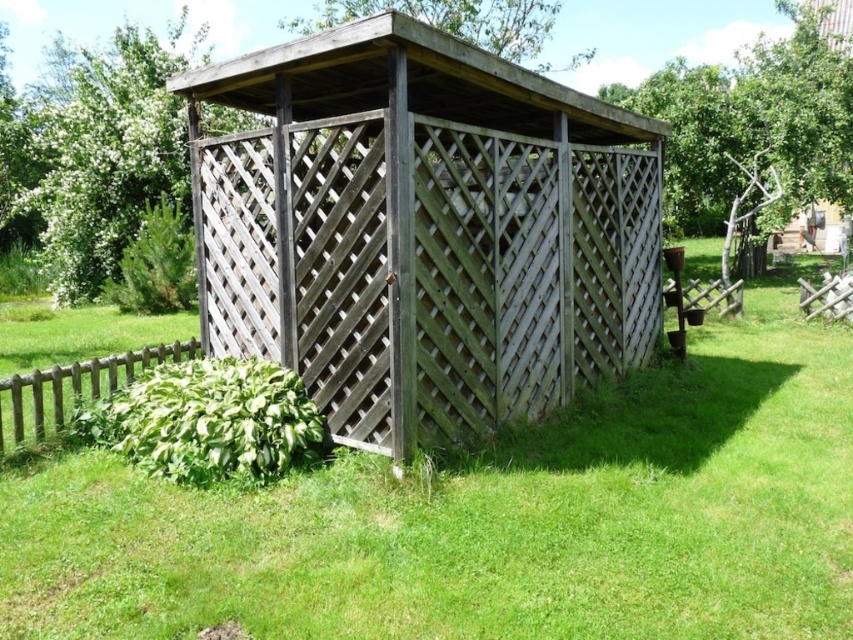
You are standing at the entrance of the wooden shed and want to place a small potted plant exactly at the center of the green grass at center. According to the coordinates provided, where should you position the potted plant?

The green grass at center is located at point [490,516], so you should position the potted plant at those coordinates to place it exactly at the center of the green grass at center.

You are planning to place a small garden statue that requires a flat surface. Given the scene, which object between the green grass at center and the weathered wood gazebo at center would be more suitable for placing the statue?

The weathered wood gazebo at center is taller than the green grass at center, so placing the statue on the gazebo would provide a stable flat surface elevated above the grass.

You are standing in the garden and want to walk from the brown wooden fence at lower left to the green grass at center. Which direction should you move in?

You should move to the right to reach the green grass at center from the brown wooden fence at lower left since the green grass at center is located to the right of the brown wooden fence at lower left.